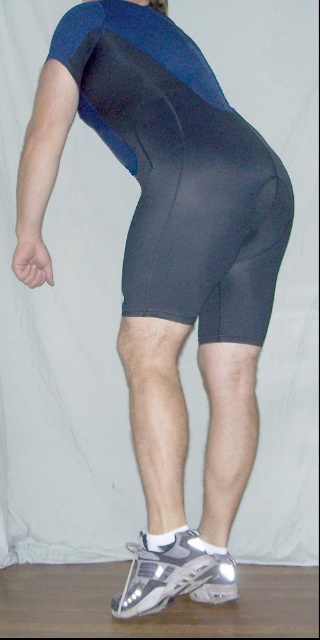
Based on the photo, you are a photographer setting up a shoot. You notice the black matte shorts at center and the matte gray shorts at lower center in the frame. Which pair of shorts should you focus on to ensure they are in sharp focus if you want to prioritize the closer object?

You should focus on the black matte shorts at center because it is closer to the viewer than the matte gray shorts at lower center.

You are a photographer setting up for a portrait shoot. You need to position a light source exactly at a point that is 5.06 feet away from the camera. The scene includes a person wearing blue short sleeved shirt and black cycling shorts. Can you place the light at the point marked as point (117, 147) in the scene?

Yes, the point (117, 147) is 5.06 feet away from the camera, so placing the light there would meet the requirement.

You are a fashion designer trying to create a new line of athletic wear. You have two shorts options to choose from in the image. The black matte shorts at center and the matte gray shorts at lower center. Which of these two shorts is positioned higher on the person?

The black matte shorts at center is taller than matte gray shorts at lower center, so the black matte shorts at center is positioned higher on the person.